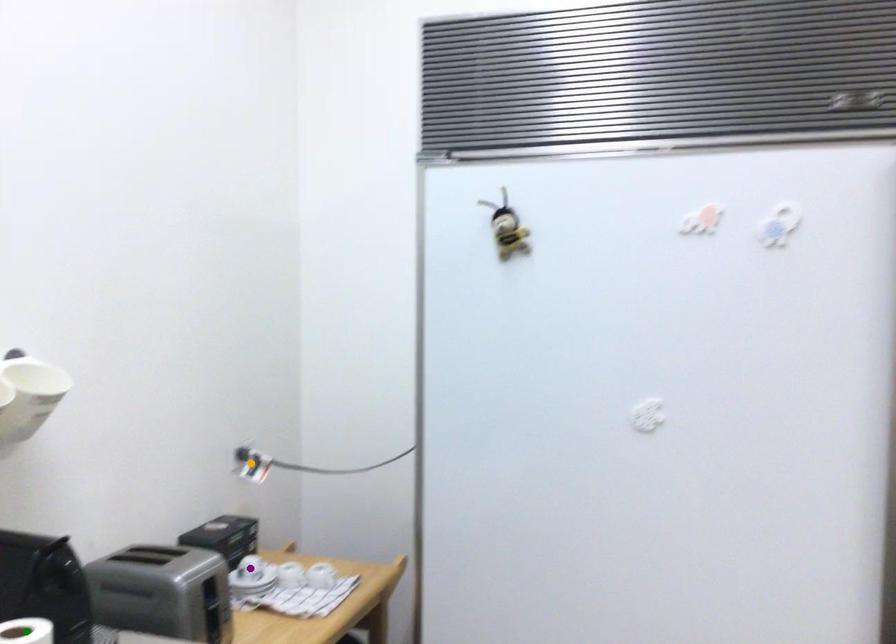
Order these from nearest to farthest:
1. green point
2. orange point
3. purple point

green point → purple point → orange point